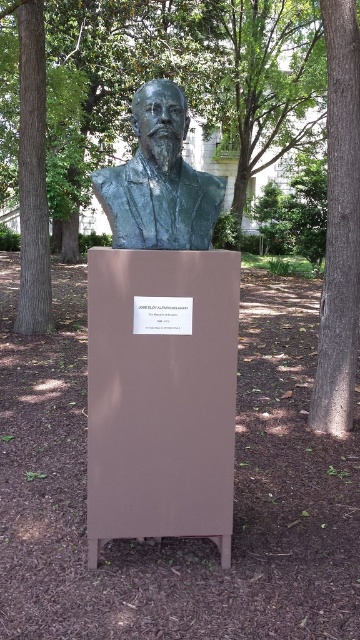
Question: Which object is positioned closest to the brown wood tree at center?

Choices:
 (A) bronze bust at center
 (B) brown textured tree at left

Answer: (B)

Question: Which point appears farthest from the camera in this image?

Choices:
 (A) (339, 392)
 (B) (268, 58)

Answer: (B)

Question: Is brown wood tree at center to the right of bronze bust at center from the viewer's perspective?

Choices:
 (A) yes
 (B) no

Answer: (B)

Question: Which point is closer to the camera taking this photo?

Choices:
 (A) (119, 225)
 (B) (271, 125)
 (C) (353, 269)

Answer: (A)

Question: Is brown wood tree at center to the right of smooth brown bark at right from the viewer's perspective?

Choices:
 (A) no
 (B) yes

Answer: (A)

Question: Is brown wood tree at center above bronze bust at center?

Choices:
 (A) no
 (B) yes

Answer: (B)